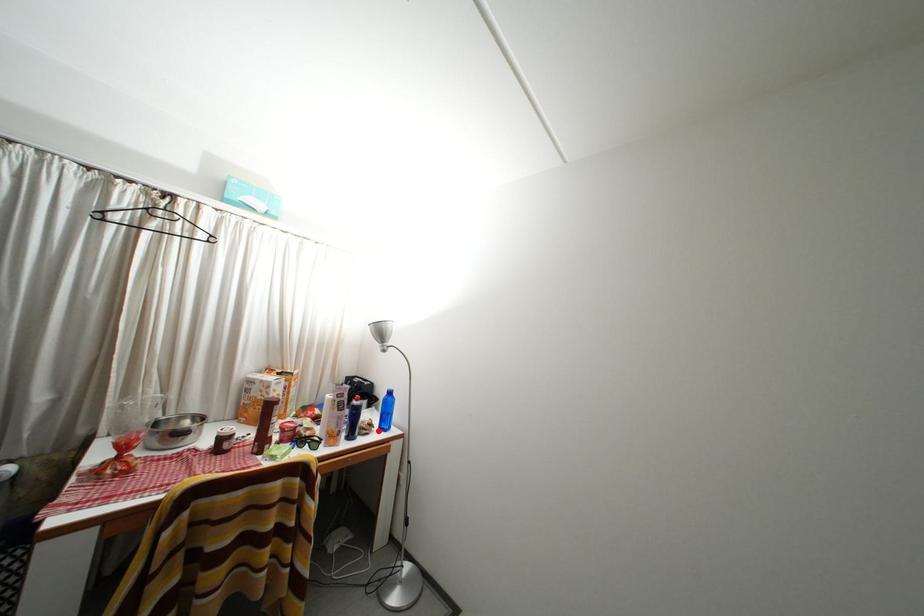
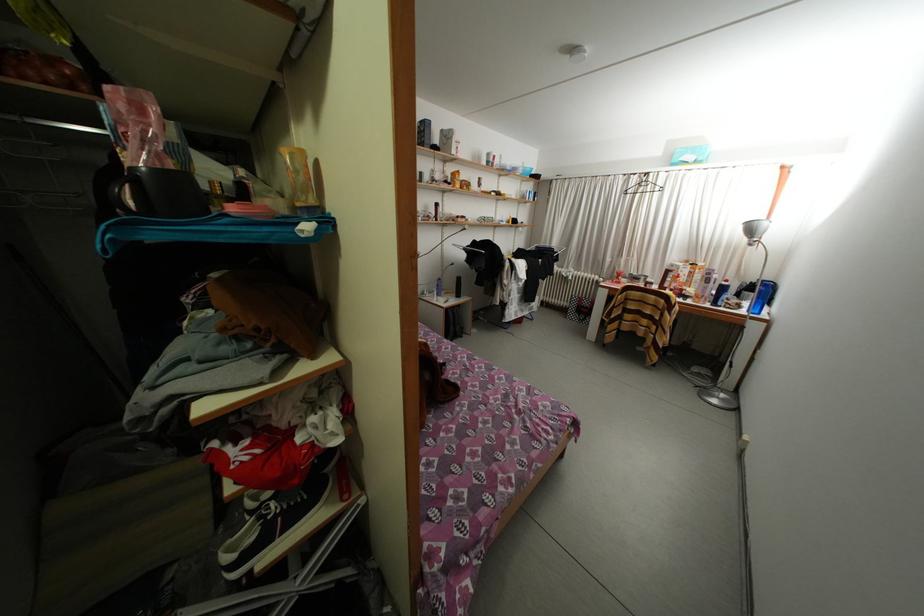
Question: I am providing you with two images of the same scene from different viewpoints. A red point is shown in image1. For the corresponding object point in image2, is it positioned nearer or farther from the camera?

Choices:
 (A) Nearer
 (B) Farther

Answer: (A)